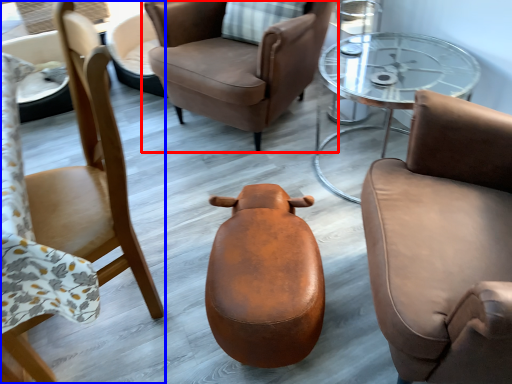
Question: Which point is closer to the camera, chair (highlighted by a red box) or chair (highlighted by a blue box)?

Choices:
 (A) chair
 (B) chair

Answer: (B)